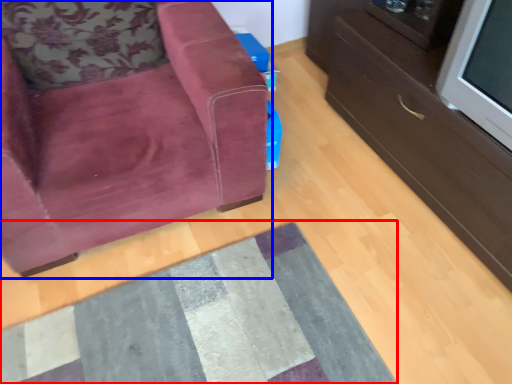
Question: Which object appears farthest to the camera in this image, mat (highlighted by a red box) or chair (highlighted by a blue box)?

Choices:
 (A) mat
 (B) chair

Answer: (A)